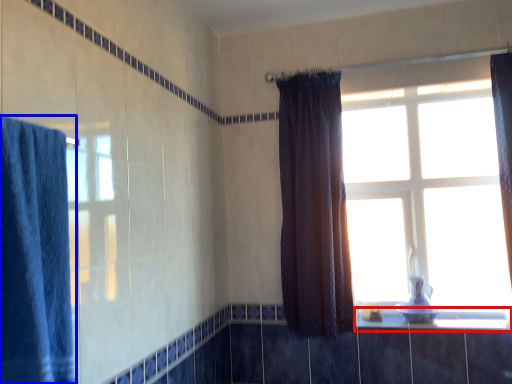
Question: Which of the following is the farthest to the observer, window sill (highlighted by a red box) or curtain (highlighted by a blue box)?

Choices:
 (A) window sill
 (B) curtain

Answer: (A)